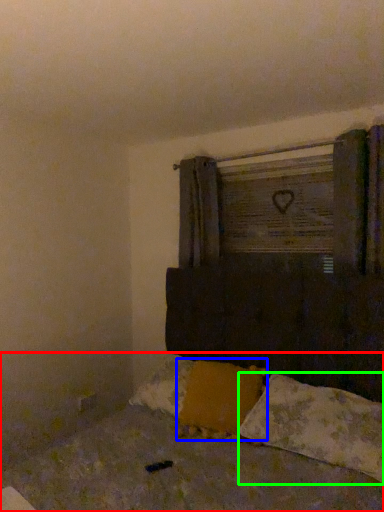
Question: Which object is positioned farthest from bed (highlighted by a red box)? Select from pillow (highlighted by a blue box) and pillow (highlighted by a green box).

Choices:
 (A) pillow
 (B) pillow

Answer: (A)